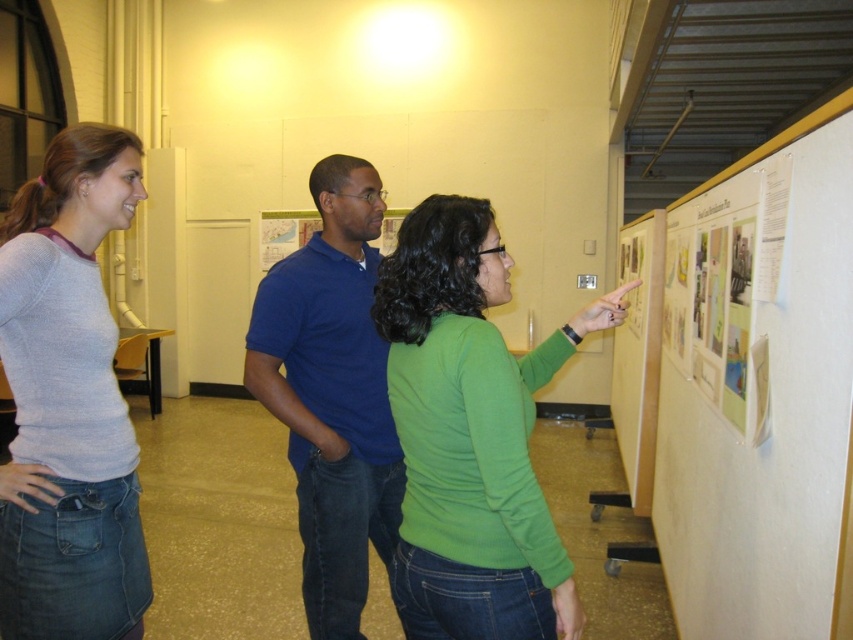
Question: Is green matte shirt at upper right thinner than light gray sweater at center?

Choices:
 (A) yes
 (B) no

Answer: (B)

Question: Which is nearer to the green matte shirt at upper right?

Choices:
 (A) white paperboard at upper right
 (B) light gray sweater at center
 (C) blue cotton shirt at center

Answer: (C)

Question: Which point is farther to the camera?

Choices:
 (A) green matte poster at upper right
 (B) light gray sweater at center

Answer: (B)

Question: Which point is closer to the camera?

Choices:
 (A) tap(323, 436)
 (B) tap(776, 224)
 (C) tap(809, 452)

Answer: (C)

Question: In this image, where is blue cotton shirt at center located relative to green matte poster at upper right?

Choices:
 (A) above
 (B) below

Answer: (B)

Question: Can you confirm if green matte shirt at upper right is positioned to the right of light gray sweater at center?

Choices:
 (A) yes
 (B) no

Answer: (A)